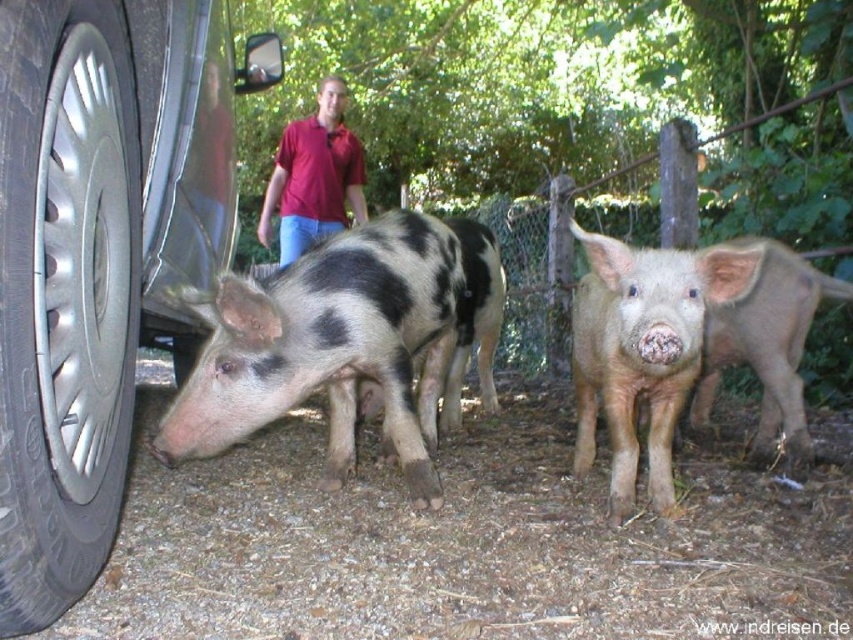
Question: Is brushed metal tire at lower left to the right of matte red shirt at center from the viewer's perspective?

Choices:
 (A) yes
 (B) no

Answer: (A)

Question: Which object is the closest to the speckled fur pig at center?

Choices:
 (A) matte red shirt at center
 (B) light brown fur piglet at center

Answer: (B)

Question: Does silver metallic tire at left have a lesser width compared to light brown fur piglet at center?

Choices:
 (A) no
 (B) yes

Answer: (B)

Question: Estimate the real-world distances between objects in this image. Which object is farther from the light brown fur piglet at center?

Choices:
 (A) speckled fur pig at center
 (B) light brown furry piglet at center

Answer: (A)

Question: Which point appears closest to the camera in this image?

Choices:
 (A) pos(395,321)
 (B) pos(349,168)
 (C) pos(20,401)
 (D) pos(183,371)

Answer: (C)

Question: Does light brown furry piglet at center appear over light brown fur piglet at center?

Choices:
 (A) no
 (B) yes

Answer: (A)